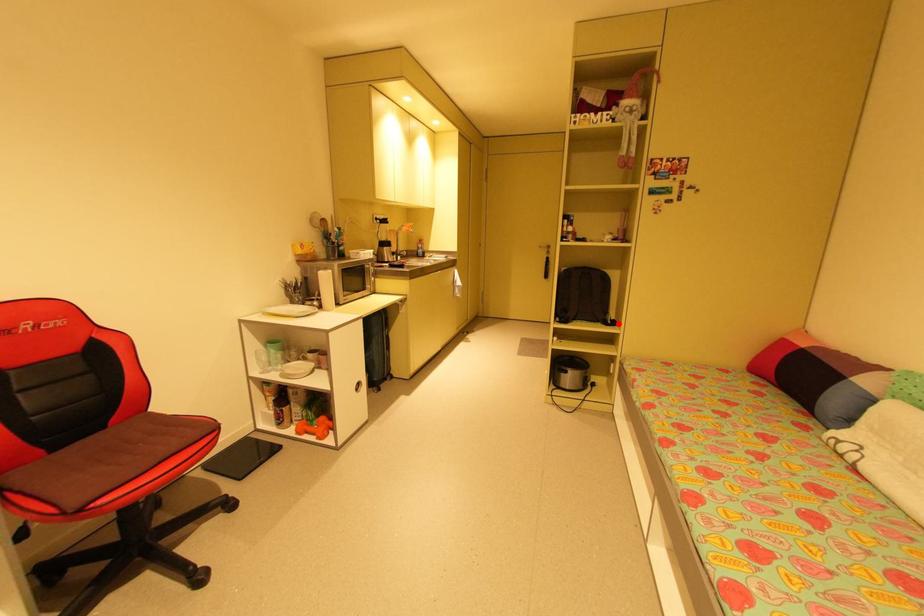
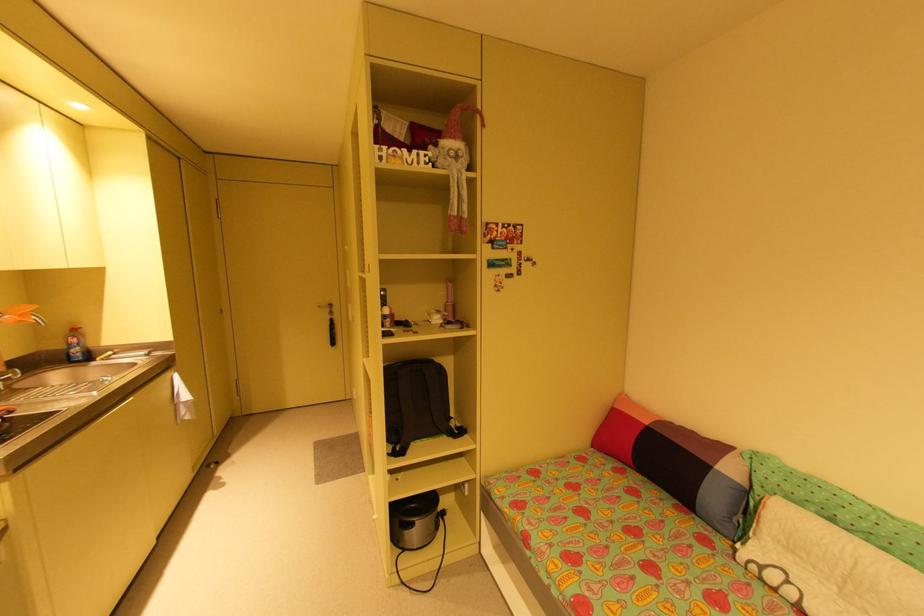
Find the pixel in the second image that matches the highlighted location in the first image.

(466, 431)